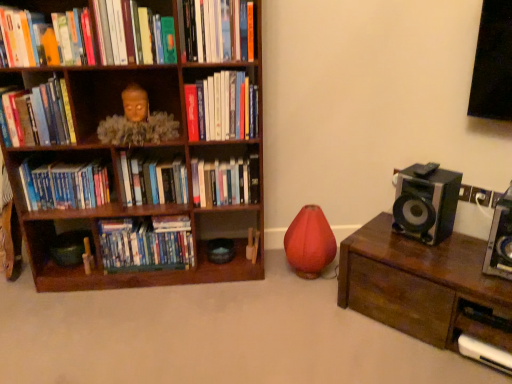
Question: Does brown wooden bookcase at left appear on the right side of hardcover book at upper center, the first book positioned from the top?

Choices:
 (A) no
 (B) yes

Answer: (A)

Question: Does brown wooden bookcase at left have a lesser height compared to hardcover book at upper center, the first book positioned from the top?

Choices:
 (A) yes
 (B) no

Answer: (B)

Question: Is hardcover book at upper center, the first book positioned from the top, located within brown wooden bookcase at left?

Choices:
 (A) yes
 (B) no

Answer: (A)

Question: From a real-world perspective, is brown wooden bookcase at left below hardcover book at upper center, the first book positioned from the top?

Choices:
 (A) no
 (B) yes

Answer: (B)

Question: Considering the relative sizes of brown wooden bookcase at left and hardcover book at upper center, the first book positioned from the top, in the image provided, is brown wooden bookcase at left wider than hardcover book at upper center, the first book positioned from the top,?

Choices:
 (A) no
 (B) yes

Answer: (B)

Question: Is matte orange book at upper left, which is the seventh book from bottom to top, wider or thinner than wooden statue at upper left?

Choices:
 (A) wide
 (B) thin

Answer: (B)

Question: Which is correct: matte orange book at upper left, acting as the 3th book starting from the top, is inside wooden statue at upper left, or outside of it?

Choices:
 (A) inside
 (B) outside

Answer: (B)

Question: In terms of size, does matte orange book at upper left, acting as the 3th book starting from the top, appear bigger or smaller than wooden statue at upper left?

Choices:
 (A) big
 (B) small

Answer: (B)

Question: In the image, is matte orange book at upper left, which is the seventh book from bottom to top, on the left side or the right side of wooden statue at upper left?

Choices:
 (A) right
 (B) left

Answer: (B)

Question: Is point (157, 180) closer or farther from the camera than point (112, 13)?

Choices:
 (A) closer
 (B) farther

Answer: (B)

Question: Considering the relative positions of hardcover books at center, marked as the 6th book in a top-to-bottom arrangement, and matte green book at upper center, the eighth book from the bottom, in the image provided, is hardcover books at center, marked as the 6th book in a top-to-bottom arrangement, to the left or to the right of matte green book at upper center, the eighth book from the bottom,?

Choices:
 (A) right
 (B) left

Answer: (A)

Question: From a real-world perspective, is hardcover books at center, the fourth book ordered from the bottom, physically located above or below matte green book at upper center, the eighth book from the bottom?

Choices:
 (A) below
 (B) above

Answer: (A)

Question: Based on their sizes in the image, would you say hardcover books at center, the fourth book ordered from the bottom, is bigger or smaller than matte green book at upper center, which is counted as the second book, starting from the top?

Choices:
 (A) small
 (B) big

Answer: (A)

Question: Would you say wooden statue at upper left is to the left or to the right of hardcover book at left, the 5th book when ordered from top to bottom, in the picture?

Choices:
 (A) left
 (B) right

Answer: (B)

Question: In the image, is wooden statue at upper left positioned in front of or behind hardcover book at left, the 5th book when ordered from top to bottom?

Choices:
 (A) front
 (B) behind

Answer: (B)